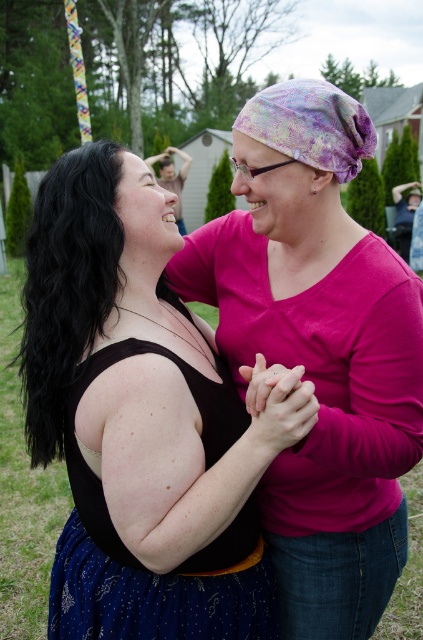
You are a photographer trying to capture the moment between the two people. You notice a point at coordinates (142,420) in the image. What object is located at this point?

The point at coordinates (142,420) corresponds to the matte pink shirt at center.

Based on the photo, you are taking a photo of two friends holding hands in a park. You notice two points in the image labeled as point 1 and point 2. If you want to focus on the point that is closer to you, which point should you choose between point [176,323] and point [269,140]?

Point [176,323] is further to the camera than point [269,140], so you should choose point [269,140] as it is closer to you.